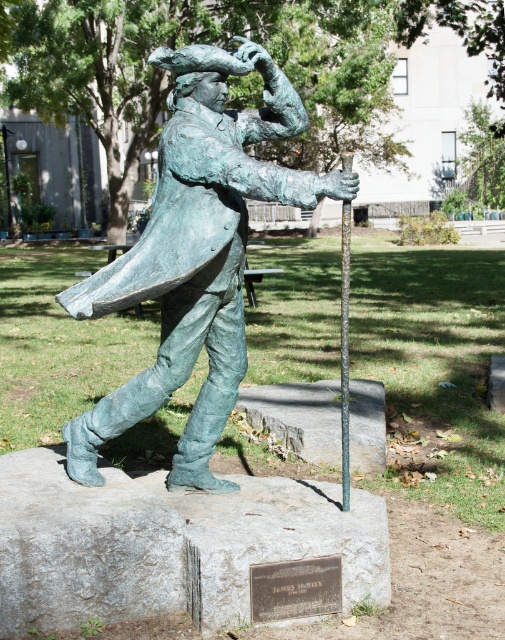
Consider the image. You are an art conservator assessing the space around the statue. Given that the green patina bronze statue at center and the green patina pole at center are both in the central area, which one takes up more space visually?

The green patina pole at center takes up more space visually than the green patina bronze statue at center, as the statue occupies less space according to the description.

You are a visitor at the statue and want to take a photo that includes both the green patina bronze statue at center and the green patina pole at center. Which object should you position closer to the camera to ensure both are in frame?

Since the green patina bronze statue at center is not as tall as the green patina pole at center, you should position the green patina bronze statue at center closer to the camera to ensure both are in frame.

Based on the scene description, where is the green patina bronze statue at center located in terms of its 2D coordinates?

The green patina bronze statue at center is located at the 2D coordinates of point (195, 256).